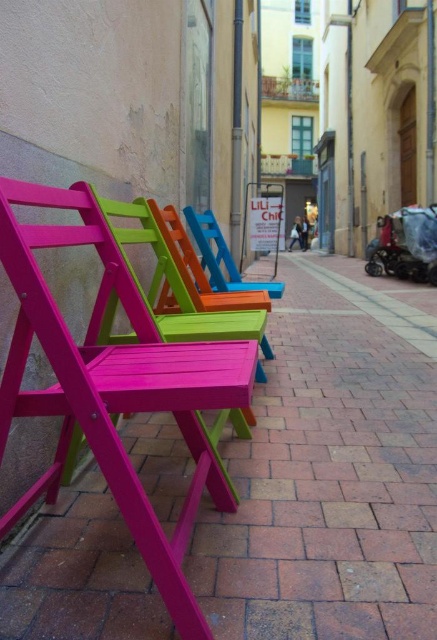
Question: Does matte pink wood chair at center have a lesser width compared to matte blue wood chair at center?

Choices:
 (A) yes
 (B) no

Answer: (A)

Question: Does matte pink wood chair at center appear under matte blue wood chair at center?

Choices:
 (A) yes
 (B) no

Answer: (A)

Question: Which object appears closest to the camera in this image?

Choices:
 (A) matte pink wood chair at center
 (B) matte blue wood chair at center

Answer: (A)

Question: Observing the image, what is the correct spatial positioning of matte pink wood chair at center in reference to matte blue wood chair at center?

Choices:
 (A) above
 (B) below

Answer: (B)

Question: Which of the following is the farthest from the observer?

Choices:
 (A) matte blue wood chair at center
 (B) matte pink wood chair at center
 (C) matte wood chairs at left

Answer: (A)

Question: Which object appears closest to the camera in this image?

Choices:
 (A) matte wood chairs at left
 (B) matte blue wood chair at center
 (C) matte pink wood chair at center

Answer: (A)